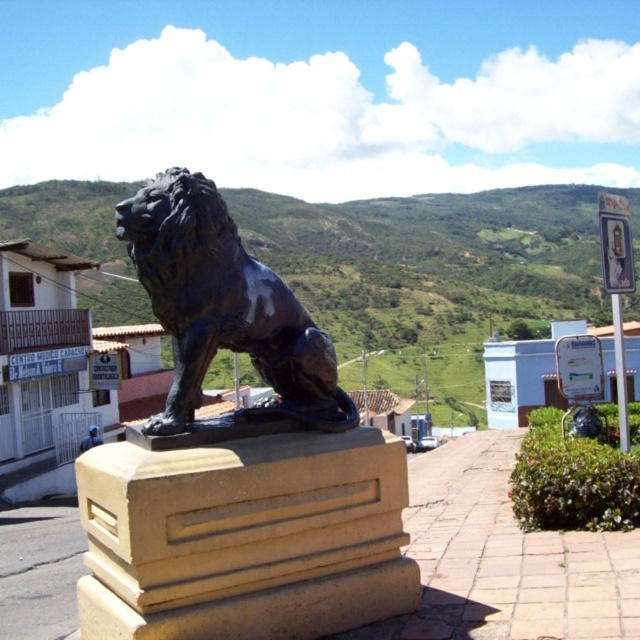
You are a delivery person trying to place a package between the beige stone pedestal at center and the shiny black lion at center. The package is 27 inches long. Can you fit the package between them?

The distance between the beige stone pedestal at center and the shiny black lion at center is 26.90 inches. Since the package is 27 inches long, it is slightly too long to fit between them.

You are standing in front of a bronze statue of a lion on a pedestal. You notice a specific point marked at coordinates [237,460]. Which object does this point correspond to?

The point at [237,460] corresponds to the black polished stone lion at center.